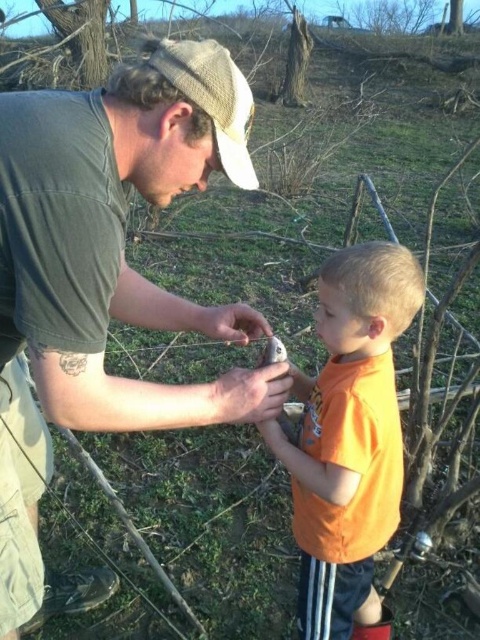
Which is behind, point (165, 38) or point (223, 61)?

Positioned behind is point (165, 38).

Can you confirm if matte green shirt at center is positioned to the right of knitted beige cap at upper center?

No, matte green shirt at center is not to the right of knitted beige cap at upper center.

Is point (118, 401) less distant than point (219, 51)?

Yes, point (118, 401) is closer to viewer.

Find the location of a particular element. The image size is (480, 640). matte green shirt at center is located at coordinates pyautogui.click(x=105, y=230).

Who is lower down, orange cotton shirt at center or matte plastic hand at center?

orange cotton shirt at center is lower down.

Does orange cotton shirt at center have a larger size compared to matte plastic hand at center?

Yes, orange cotton shirt at center is bigger than matte plastic hand at center.

Is point (358, 484) positioned in front of point (254, 337)?

Yes, it is.

Find the location of `orange cotton shirt at center`. orange cotton shirt at center is located at coordinates (348, 438).

Which of these two, orange cotton shirt at center or smooth skin hand at center, stands shorter?

With less height is smooth skin hand at center.

Between orange cotton shirt at center and smooth skin hand at center, which one has more height?

With more height is orange cotton shirt at center.

Where is `orange cotton shirt at center`? This screenshot has width=480, height=640. orange cotton shirt at center is located at coordinates (348, 438).